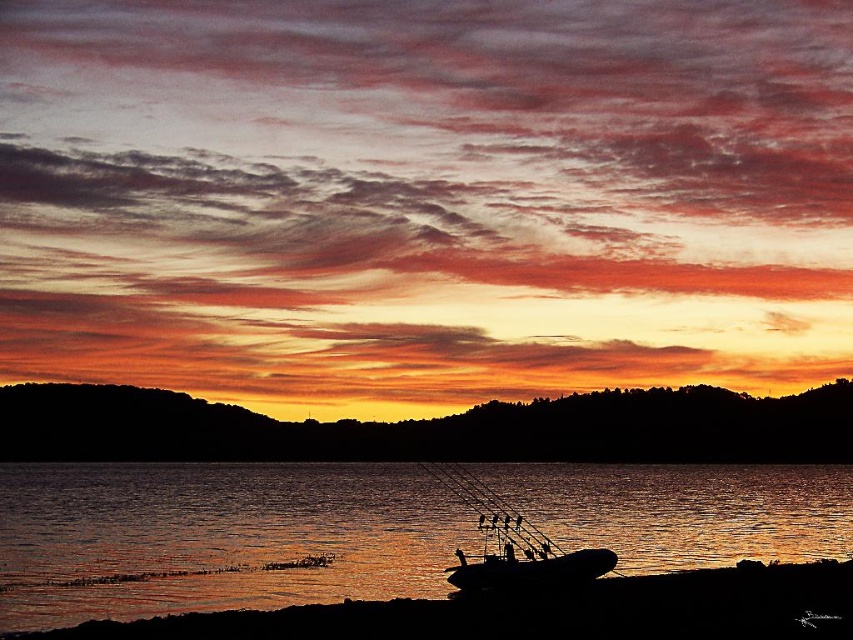
Question: Does orange sky at horizon have a greater width compared to black matte boat at lower center?

Choices:
 (A) yes
 (B) no

Answer: (A)

Question: Which object is the farthest from the silhouette rubber boat at center?

Choices:
 (A) glistening water at lower center
 (B) orange sky at horizon
 (C) black matte boat at lower center
 (D) smooth sand at lower center

Answer: (B)

Question: Does glistening water at lower center have a larger size compared to silhouette rubber boat at center?

Choices:
 (A) no
 (B) yes

Answer: (B)

Question: Which object is positioned closest to the silhouette rubber boat at center?

Choices:
 (A) orange sky at horizon
 (B) smooth sand at lower center
 (C) glistening water at lower center

Answer: (B)

Question: Is glistening water at lower center further to the viewer compared to orange sky at horizon?

Choices:
 (A) no
 (B) yes

Answer: (A)

Question: Estimate the real-world distances between objects in this image. Which object is closer to the orange sky at horizon?

Choices:
 (A) silhouette rubber boat at center
 (B) black matte boat at lower center
 (C) smooth sand at lower center
 (D) glistening water at lower center

Answer: (A)